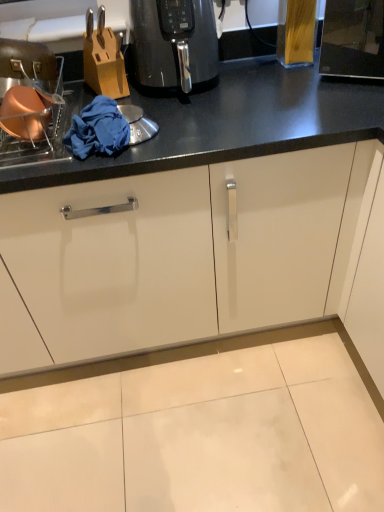
What do you see at coordinates (174, 42) in the screenshot?
I see `black glossy air fryer at center` at bounding box center [174, 42].

In order to face matte copper pot at left, should I rotate leftwards or rightwards?

You should look left and rotate roughly 22.192 degrees.

Find the location of a particular element. matte copper pot at left is located at coordinates (36, 112).

What are the coordinates of `black glossy air fryer at center` in the screenshot? It's located at (174, 42).

In terms of width, does blue fabric at left look wider or thinner when compared to black glossy air fryer at center?

blue fabric at left is thinner than black glossy air fryer at center.

From the image's perspective, is blue fabric at left located above or below black glossy air fryer at center?

Based on their image positions, blue fabric at left is located beneath black glossy air fryer at center.

Is blue fabric at left closer to the viewer compared to black glossy air fryer at center?

That is True.

Considering the sizes of blue fabric at left and black glossy air fryer at center in the image, is blue fabric at left taller or shorter than black glossy air fryer at center?

blue fabric at left is shorter than black glossy air fryer at center.

I want to click on home appliance on the right side of matte copper pot at left, so click(x=174, y=42).

From the image's perspective, which object appears higher, matte copper pot at left or black glossy air fryer at center?

black glossy air fryer at center appears higher in the image.

Considering the sizes of objects matte copper pot at left and black glossy air fryer at center in the image provided, who is wider, matte copper pot at left or black glossy air fryer at center?

With larger width is matte copper pot at left.

Between matte copper pot at left and black glossy air fryer at center, which one has less height?

Standing shorter between the two is matte copper pot at left.

Looking at their sizes, would you say matte copper pot at left is wider or thinner than blue fabric at left?

matte copper pot at left is wider than blue fabric at left.

From the image's perspective, does matte copper pot at left appear higher than blue fabric at left?

Yes, from the image's perspective, matte copper pot at left is on top of blue fabric at left.

Is point (57, 80) positioned before point (119, 130)?

That is False.

Between matte copper pot at left and blue fabric at left, which one has smaller size?

blue fabric at left is smaller.

From a real-world perspective, is black glossy air fryer at center physically located above or below matte copper pot at left?

black glossy air fryer at center is situated higher than matte copper pot at left in the real world.

Image resolution: width=384 pixels, height=512 pixels. Identify the location of home appliance positioned vertically above the matte copper pot at left (from a real-world perspective). (174, 42).

Does black glossy air fryer at center have a lesser height compared to matte copper pot at left?

In fact, black glossy air fryer at center may be taller than matte copper pot at left.

Is black glossy air fryer at center positioned with its back to blue fabric at left?

No, black glossy air fryer at center is not facing away from blue fabric at left.

From a real-world perspective, which object rests below the other?

blue fabric at left, from a real-world perspective.

Which of these two, black glossy air fryer at center or blue fabric at left, is smaller?

blue fabric at left is smaller.

From the image's perspective, who appears lower, black glossy air fryer at center or blue fabric at left?

blue fabric at left.

From a real-world perspective, is blue fabric at left below matte copper pot at left?

Yes.

In the image, is blue fabric at left positioned in front of or behind matte copper pot at left?

Visually, blue fabric at left is located behind matte copper pot at left.

Considering the sizes of objects blue fabric at left and matte copper pot at left in the image provided, who is wider, blue fabric at left or matte copper pot at left?

With larger width is matte copper pot at left.

Can you see blue fabric at left touching matte copper pot at left?

No, blue fabric at left is not beside matte copper pot at left.

Where is `home appliance behind the blue fabric at left`? The image size is (384, 512). home appliance behind the blue fabric at left is located at coordinates (174, 42).

This screenshot has width=384, height=512. Find the location of `appliance below the black glossy air fryer at center (from the image's perspective)`. appliance below the black glossy air fryer at center (from the image's perspective) is located at coordinates (36, 112).

Based on their spatial positions, is black glossy air fryer at center or blue fabric at left closer to matte copper pot at left?

Based on the image, blue fabric at left appears to be nearer to matte copper pot at left.

Looking at the image, which one is located further to black glossy air fryer at center, matte copper pot at left or blue fabric at left?

matte copper pot at left is positioned further to the anchor black glossy air fryer at center.

From the image, which object appears to be farther from blue fabric at left, matte copper pot at left or black glossy air fryer at center?

Based on the image, black glossy air fryer at center appears to be further to blue fabric at left.

When comparing their distances from matte copper pot at left, does blue fabric at left or black glossy air fryer at center seem further?

black glossy air fryer at center.

Considering their positions, is black glossy air fryer at center positioned further to blue fabric at left than matte copper pot at left?

Based on the image, black glossy air fryer at center appears to be further to blue fabric at left.

Based on their spatial positions, is blue fabric at left or matte copper pot at left further from black glossy air fryer at center?

matte copper pot at left is further to black glossy air fryer at center.

Locate an element on the screen. material situated between matte copper pot at left and black glossy air fryer at center from left to right is located at coordinates (98, 129).